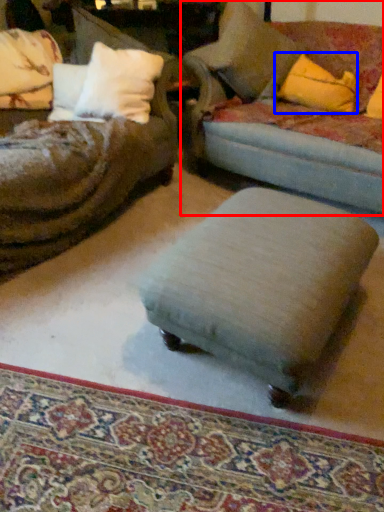
Question: Which object is closer to the camera taking this photo, studio couch (highlighted by a red box) or throw pillow (highlighted by a blue box)?

Choices:
 (A) studio couch
 (B) throw pillow

Answer: (A)